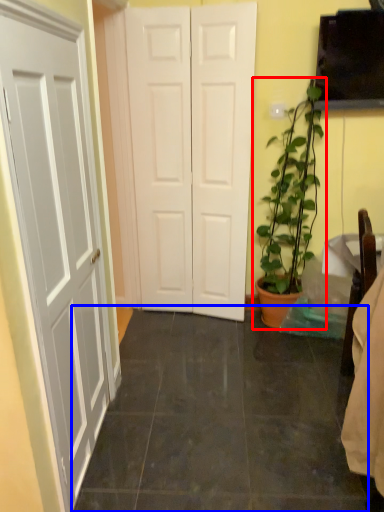
Question: Which object appears closest to the camera in this image, houseplant (highlighted by a red box) or tile (highlighted by a blue box)?

Choices:
 (A) houseplant
 (B) tile

Answer: (B)